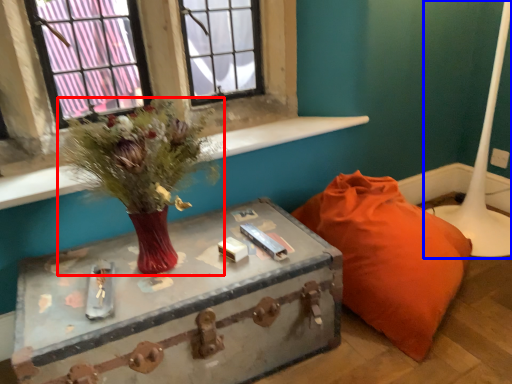
Question: Which object is further to the camera taking this photo, floral arrangement (highlighted by a red box) or table lamp (highlighted by a blue box)?

Choices:
 (A) floral arrangement
 (B) table lamp

Answer: (B)